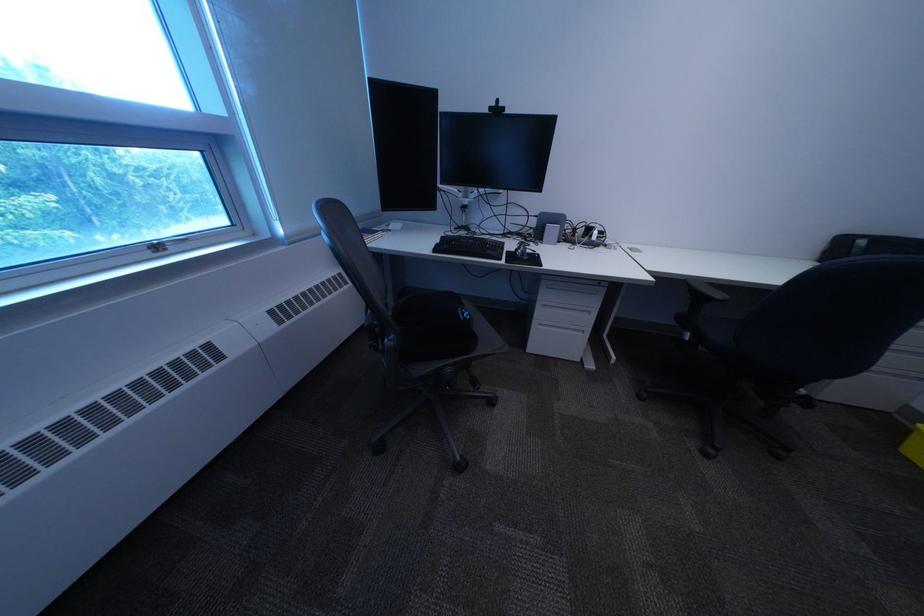
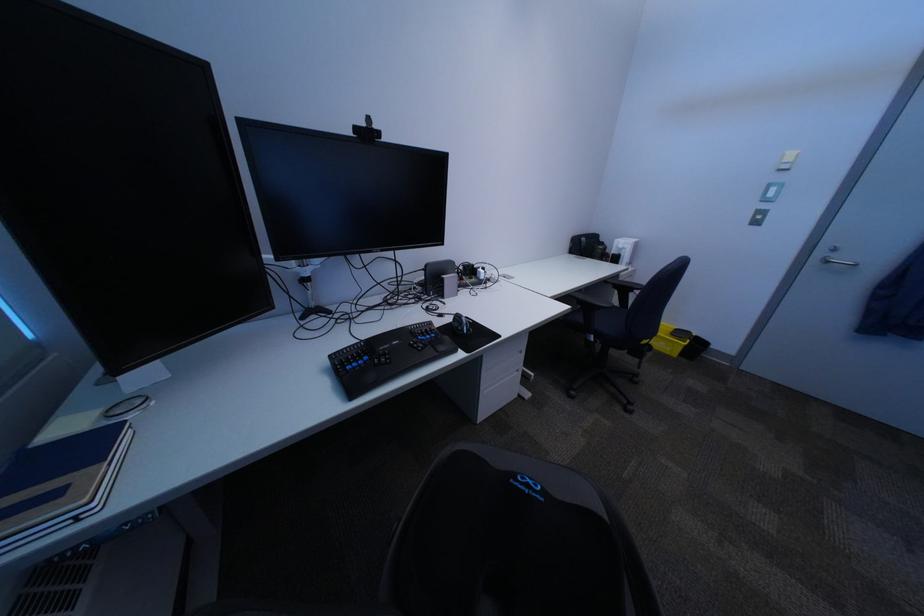
Question: The first image is from the beginning of the video and the second image is from the end. How did the camera likely rotate when shooting the video?

Choices:
 (A) Left
 (B) Right
 (C) Up
 (D) Down

Answer: (B)